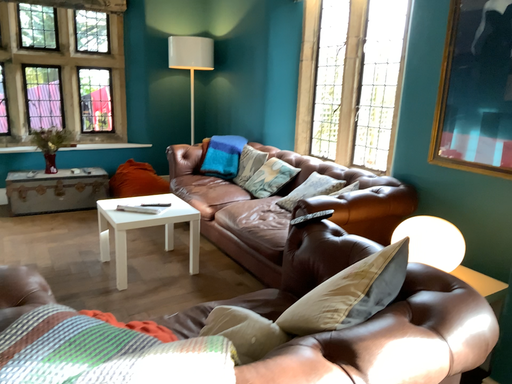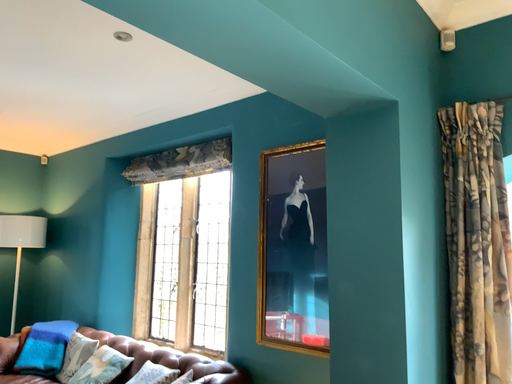
Question: How did the camera likely rotate when shooting the video?

Choices:
 (A) rotated downward
 (B) rotated upward

Answer: (B)